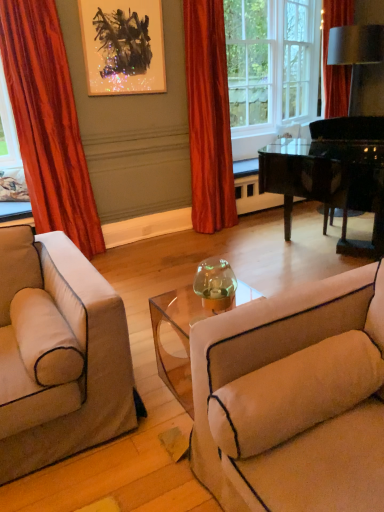
This screenshot has height=512, width=384. In order to click on vacant space underneath black glossy piano at center right (from a real-world perspective) in this screenshot , I will do `click(310, 264)`.